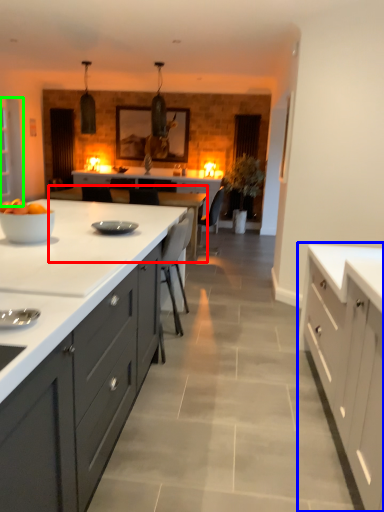
Question: Which object is the farthest from table (highlighted by a red box)? Choose among these: cabinetry (highlighted by a blue box) or glass door (highlighted by a green box).

Choices:
 (A) cabinetry
 (B) glass door

Answer: (A)